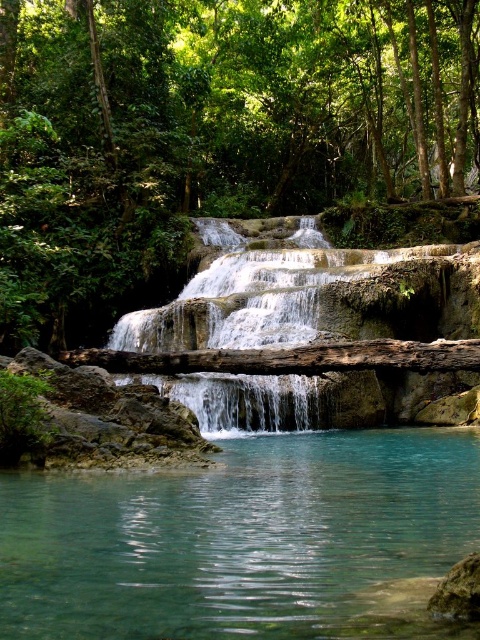
Can you confirm if clear glass water at center is shorter than clear water at center?

Correct, clear glass water at center is not as tall as clear water at center.

Which of these two, clear glass water at center or clear water at center, stands taller?

With more height is clear water at center.

Locate an element on the screen. The image size is (480, 640). clear glass water at center is located at coordinates (241, 540).

This screenshot has width=480, height=640. What are the coordinates of `clear glass water at center` in the screenshot? It's located at (241, 540).

In the scene shown: Does green leafy tree at center have a smaller size compared to clear glass water at center?

No.

Is point (34, 52) farther from camera compared to point (467, 474)?

Yes, it is behind point (467, 474).

Find the location of a particular element. green leafy tree at center is located at coordinates (207, 132).

Measure the distance from green leafy tree at center to clear water at center.

green leafy tree at center is 19.93 meters away from clear water at center.

Is point (385, 161) positioned behind point (189, 404)?

Yes, point (385, 161) is behind point (189, 404).

Where is `green leafy tree at center`? This screenshot has height=640, width=480. green leafy tree at center is located at coordinates (207, 132).